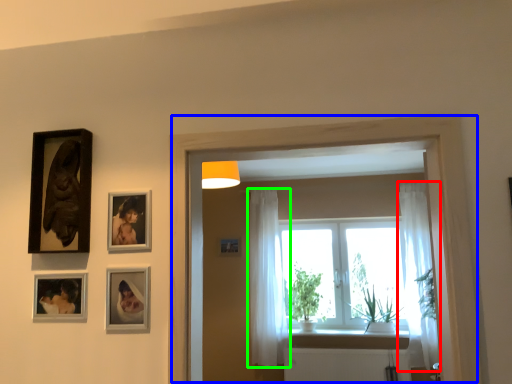
Question: Considering the real-world distances, which object is closest to curtain (highlighted by a red box)? window frame (highlighted by a blue box) or curtain (highlighted by a green box).

Choices:
 (A) window frame
 (B) curtain

Answer: (B)